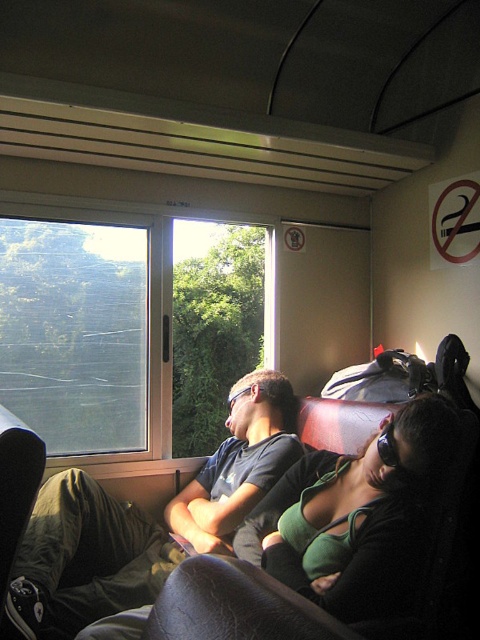
Who is lower down, matte black shirt at left or green fabric top at center?

matte black shirt at left is below.

From the picture: Who is more distant from viewer, (243,397) or (319,564)?

The point (243,397) is more distant.

Which is behind, point (260, 442) or point (343, 548)?

The point (260, 442) is more distant.

The height and width of the screenshot is (640, 480). I want to click on matte black shirt at left, so click(84, 560).

Is point (72, 611) farther from viewer compared to point (143, 368)?

That is False.

Is matte black shirt at left bigger than transparent glass window at upper left?

Yes.

Between point (56, 572) and point (96, 376), which one is positioned behind?

Positioned behind is point (96, 376).

I want to click on matte black shirt at left, so click(84, 560).

From the picture: Can you confirm if transparent glass window at upper left is bigger than green fabric top at center?

Incorrect, transparent glass window at upper left is not larger than green fabric top at center.

Which is above, transparent glass window at upper left or green fabric top at center?

Positioned higher is transparent glass window at upper left.

Identify the location of transparent glass window at upper left. (74, 333).